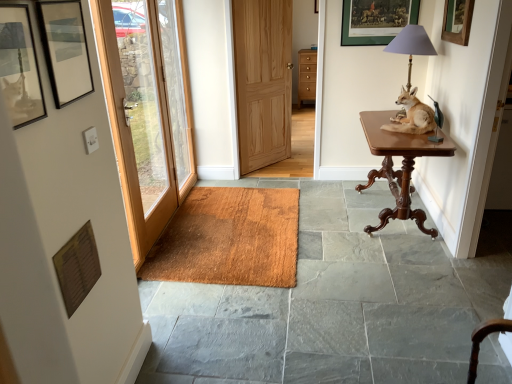
You are a GUI agent. You are given a task and a screenshot of the screen. Output one action in this format:
    pyautogui.click(x=<x>, y=<y>)
    Task: Click on the vacant space underneath mahogany wood table at right (from a real-world perspective)
    The width and height of the screenshot is (512, 384).
    Given the screenshot: What is the action you would take?
    pyautogui.click(x=385, y=208)